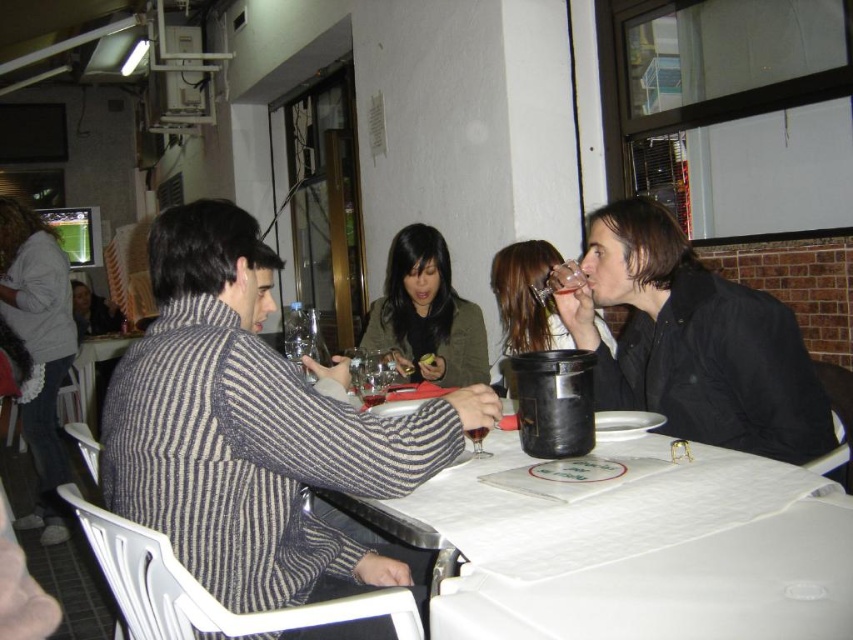
Identify the location of white textured table at center. The width and height of the screenshot is (853, 640). (642, 554).

The height and width of the screenshot is (640, 853). I want to click on white textured table at center, so click(642, 554).

Between striped sweater at left and white textured table at center, which one appears on the left side from the viewer's perspective?

From the viewer's perspective, striped sweater at left appears more on the left side.

Does striped sweater at left appear under white textured table at center?

No, striped sweater at left is not below white textured table at center.

Does point (355, 552) lie in front of point (795, 618)?

No, it is not.

You are a GUI agent. You are given a task and a screenshot of the screen. Output one action in this format:
    pyautogui.click(x=<x>, y=<y>)
    Task: Click on the striped sweater at left
    
    Given the screenshot: What is the action you would take?
    pyautogui.click(x=254, y=433)

Does point (671, 371) come behind point (480, 444)?

Yes, it is.

Is black matte jacket at right to the left of transparent glass at center from the viewer's perspective?

No, black matte jacket at right is not to the left of transparent glass at center.

Is point (706, 371) positioned after point (482, 452)?

Yes, it is.

Where is `black matte jacket at right`? Image resolution: width=853 pixels, height=640 pixels. black matte jacket at right is located at coordinates (693, 340).